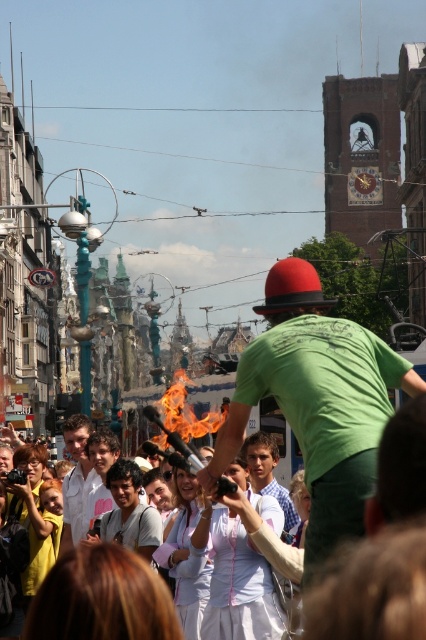
Question: Which is farther from the light brown hair at center?

Choices:
 (A) white shirt at center
 (B) green matte shirt at center
 (C) light blue shirt at center

Answer: (B)

Question: Which object is farther from the camera taking this photo?

Choices:
 (A) white shirt at center
 (B) green matte shirt at center
 (C) light brown hair at center

Answer: (C)

Question: Considering the relative positions of white shirt at center and light brown hair at center in the image provided, where is white shirt at center located with respect to light brown hair at center?

Choices:
 (A) right
 (B) left

Answer: (B)

Question: Does green matte shirt at center appear on the left side of light blue shirt at center?

Choices:
 (A) no
 (B) yes

Answer: (A)

Question: Which point is closer to the camera taking this photo?

Choices:
 (A) (316, 442)
 (B) (253, 481)
 (C) (115, 460)

Answer: (A)

Question: Where is green matte shirt at center located in relation to white shirt at center in the image?

Choices:
 (A) right
 (B) left

Answer: (A)